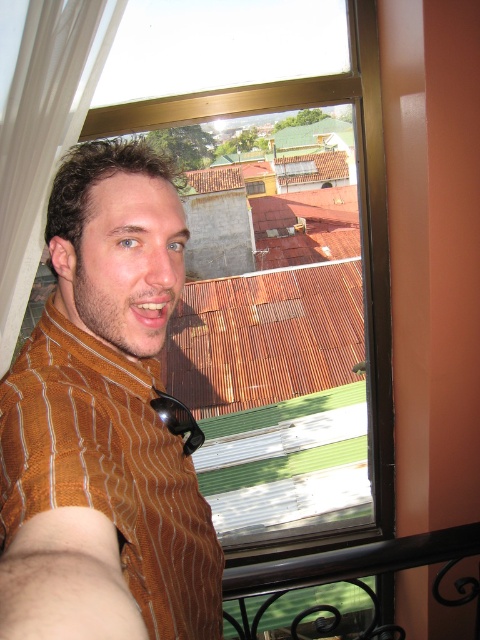
Question: Which object appears closest to the camera in this image?

Choices:
 (A) brown striped shirt at center
 (B) black wrought iron at lower right

Answer: (A)

Question: Is brown striped shirt at center in front of black wrought iron at lower right?

Choices:
 (A) no
 (B) yes

Answer: (B)

Question: Can you confirm if brown striped shirt at center is smaller than black wrought iron at lower right?

Choices:
 (A) no
 (B) yes

Answer: (A)

Question: Can you confirm if brown striped shirt at center is thinner than black wrought iron at lower right?

Choices:
 (A) yes
 (B) no

Answer: (A)

Question: Which point appears closest to the camera in this image?

Choices:
 (A) (385, 564)
 (B) (24, 433)

Answer: (B)